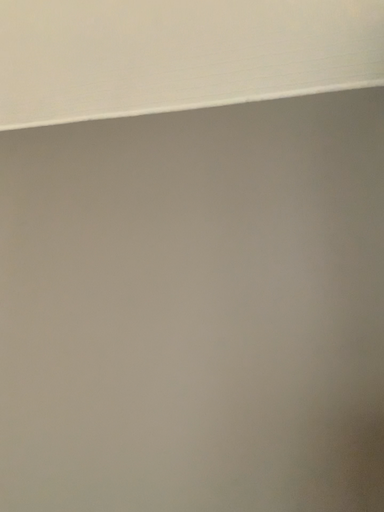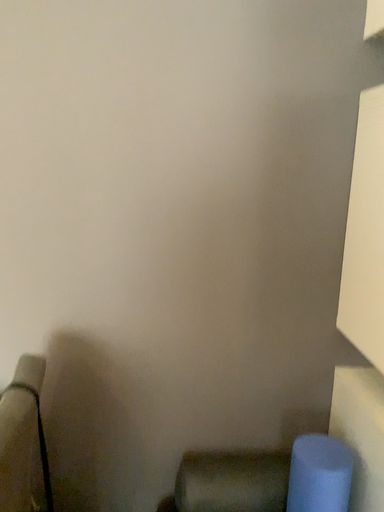
Question: Which way did the camera rotate in the video?

Choices:
 (A) rotated upward
 (B) rotated downward

Answer: (B)